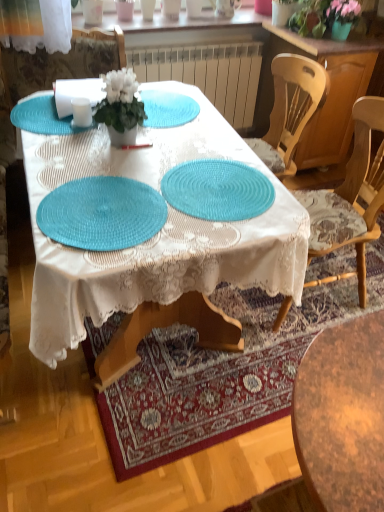
Question: Is teal woven placemat at center, the 1th glass plate ordered from the bottom, aimed at teal woven placemat at center?

Choices:
 (A) yes
 (B) no

Answer: (A)

Question: Does teal woven placemat at center, the 1th glass plate ordered from the bottom, have a lesser width compared to teal woven placemat at center?

Choices:
 (A) yes
 (B) no

Answer: (A)

Question: From the image's perspective, does teal woven placemat at center, the 1th glass plate ordered from the bottom, appear lower than teal woven placemat at center?

Choices:
 (A) yes
 (B) no

Answer: (A)

Question: Does teal woven placemat at center, positioned as the 3th glass plate in top-to-bottom order, come in front of teal woven placemat at center?

Choices:
 (A) no
 (B) yes

Answer: (A)

Question: Can you confirm if teal woven placemat at center, the 1th glass plate ordered from the bottom, is shorter than teal woven placemat at center?

Choices:
 (A) no
 (B) yes

Answer: (B)

Question: From a real-world perspective, is teal woven placemat at center, positioned as the 3th glass plate in top-to-bottom order, located beneath teal woven placemat at center?

Choices:
 (A) yes
 (B) no

Answer: (B)

Question: Is teal woven placemat at center, positioned as the 3th glass plate in top-to-bottom order, facing towards teal woven placemat at upper left, which ranks as the third glass plate in bottom-to-top order?

Choices:
 (A) no
 (B) yes

Answer: (A)

Question: Considering the relative sizes of teal woven placemat at center, the 1th glass plate ordered from the bottom, and teal woven placemat at upper left, acting as the first glass plate starting from the top, in the image provided, is teal woven placemat at center, the 1th glass plate ordered from the bottom, wider than teal woven placemat at upper left, acting as the first glass plate starting from the top,?

Choices:
 (A) yes
 (B) no

Answer: (A)

Question: Is teal woven placemat at center, positioned as the 3th glass plate in top-to-bottom order, further to camera compared to teal woven placemat at upper left, which ranks as the third glass plate in bottom-to-top order?

Choices:
 (A) yes
 (B) no

Answer: (B)

Question: Is teal woven placemat at center, positioned as the 3th glass plate in top-to-bottom order, thinner than teal woven placemat at upper left, acting as the first glass plate starting from the top?

Choices:
 (A) yes
 (B) no

Answer: (B)

Question: Is teal woven placemat at center, positioned as the 3th glass plate in top-to-bottom order, at the right side of teal woven placemat at upper left, which ranks as the third glass plate in bottom-to-top order?

Choices:
 (A) no
 (B) yes

Answer: (B)

Question: Is teal woven placemat at center, the 1th glass plate ordered from the bottom, closer to camera compared to teal woven placemat at upper left, which ranks as the third glass plate in bottom-to-top order?

Choices:
 (A) yes
 (B) no

Answer: (A)

Question: Can you confirm if matte white chair at upper left, the second chair in the right-to-left sequence, is taller than teal woven placemat at center, the 1th glass plate ordered from the bottom?

Choices:
 (A) yes
 (B) no

Answer: (A)